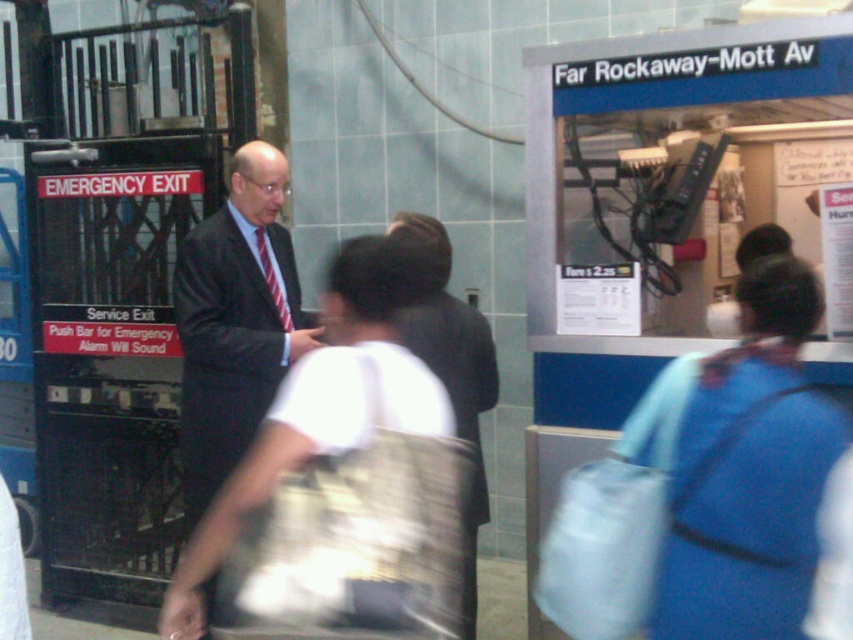
Question: Can you confirm if blue fabric bag at center is bigger than white fabric bag at center?

Choices:
 (A) yes
 (B) no

Answer: (B)

Question: Which point is closer to the camera taking this photo?

Choices:
 (A) (753, 417)
 (B) (265, 161)
 (C) (379, 406)

Answer: (C)

Question: Which of the following is the closest to the observer?

Choices:
 (A) blue fabric bag at center
 (B) dark suit at left
 (C) white fabric bag at center

Answer: (C)

Question: Is white fabric bag at center wider than dark suit at left?

Choices:
 (A) no
 (B) yes

Answer: (B)

Question: Based on their relative distances, which object is nearer to the blue fabric bag at center?

Choices:
 (A) white fabric bag at center
 (B) dark suit at left

Answer: (A)

Question: Is blue fabric bag at center smaller than dark suit at left?

Choices:
 (A) yes
 (B) no

Answer: (A)